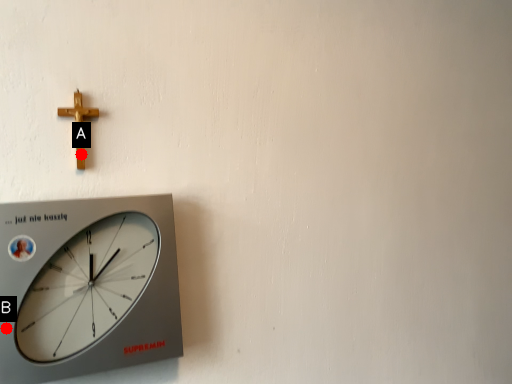
Question: Two points are circled on the image, labeled by A and B beside each circle. Among these points, which one is nearest to the camera?

Choices:
 (A) A is closer
 (B) B is closer

Answer: (B)